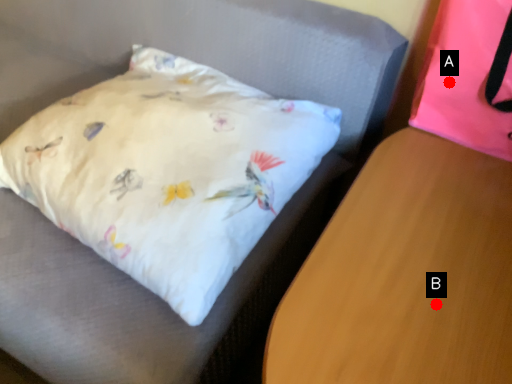
Question: Two points are circled on the image, labeled by A and B beside each circle. Which point is closer to the camera taking this photo?

Choices:
 (A) A is closer
 (B) B is closer

Answer: (B)